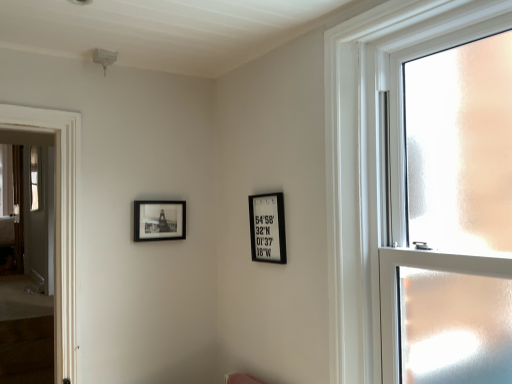
Question: Does black matte picture frame at upper left, which ranks as the first picture frame in left-to-right order, have a lesser height compared to clear glass window at right?

Choices:
 (A) yes
 (B) no

Answer: (A)

Question: Is black matte picture frame at upper left, which ranks as the first picture frame in left-to-right order, aimed at clear glass window at right?

Choices:
 (A) yes
 (B) no

Answer: (A)

Question: Considering the relative positions of black matte picture frame at upper left, the second picture frame viewed from the right, and clear glass window at right in the image provided, is black matte picture frame at upper left, the second picture frame viewed from the right, to the right of clear glass window at right from the viewer's perspective?

Choices:
 (A) yes
 (B) no

Answer: (B)

Question: Are black matte picture frame at upper left, the second picture frame viewed from the right, and clear glass window at right beside each other?

Choices:
 (A) no
 (B) yes

Answer: (A)

Question: Does black matte picture frame at upper left, which ranks as the first picture frame in left-to-right order, have a greater height compared to clear glass window at right?

Choices:
 (A) no
 (B) yes

Answer: (A)

Question: In the image, is black matte picture frame at upper center, the 2th picture frame viewed from the left, on the left side or the right side of clear glass window at right?

Choices:
 (A) right
 (B) left

Answer: (B)

Question: In terms of size, does black matte picture frame at upper center, the 2th picture frame viewed from the left, appear bigger or smaller than clear glass window at right?

Choices:
 (A) small
 (B) big

Answer: (A)

Question: From the image's perspective, is black matte picture frame at upper center, positioned as the first picture frame in right-to-left order, above or below clear glass window at right?

Choices:
 (A) below
 (B) above

Answer: (A)

Question: Choose the correct answer: Is black matte picture frame at upper center, the 2th picture frame viewed from the left, inside clear glass window at right or outside it?

Choices:
 (A) outside
 (B) inside

Answer: (A)

Question: Does point (162, 228) appear closer or farther from the camera than point (262, 196)?

Choices:
 (A) farther
 (B) closer

Answer: (A)

Question: From their relative heights in the image, would you say black matte picture frame at upper left, which ranks as the first picture frame in left-to-right order, is taller or shorter than black matte picture frame at upper center, the 2th picture frame viewed from the left?

Choices:
 (A) tall
 (B) short

Answer: (B)

Question: From the image's perspective, is black matte picture frame at upper left, which ranks as the first picture frame in left-to-right order, positioned above or below black matte picture frame at upper center, the 2th picture frame viewed from the left?

Choices:
 (A) above
 (B) below

Answer: (A)

Question: Is black matte picture frame at upper left, which ranks as the first picture frame in left-to-right order, bigger or smaller than black matte picture frame at upper center, the 2th picture frame viewed from the left?

Choices:
 (A) small
 (B) big

Answer: (A)

Question: Considering their positions, is black matte picture frame at upper center, positioned as the first picture frame in right-to-left order, located in front of or behind black matte picture frame at upper left, which ranks as the first picture frame in left-to-right order?

Choices:
 (A) front
 (B) behind

Answer: (A)

Question: Is black matte picture frame at upper center, positioned as the first picture frame in right-to-left order, taller or shorter than black matte picture frame at upper left, which ranks as the first picture frame in left-to-right order?

Choices:
 (A) short
 (B) tall

Answer: (B)